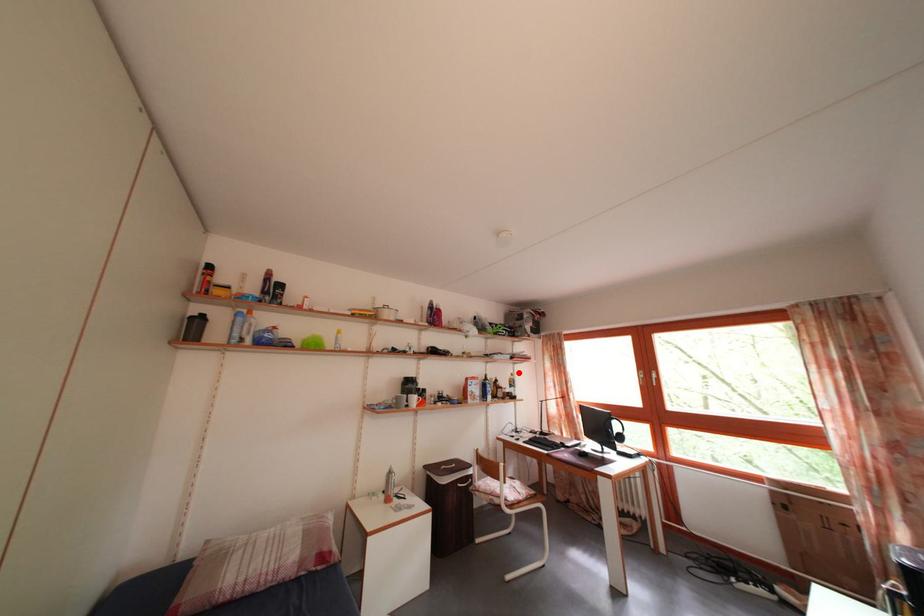
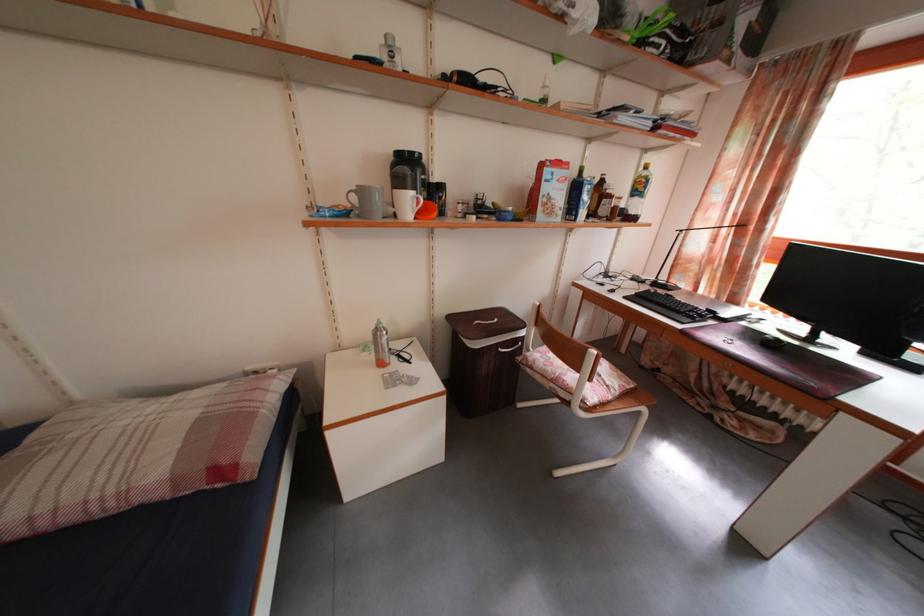
The point at the highlighted location is marked in the first image. Where is the corresponding point in the second image?

(643, 161)